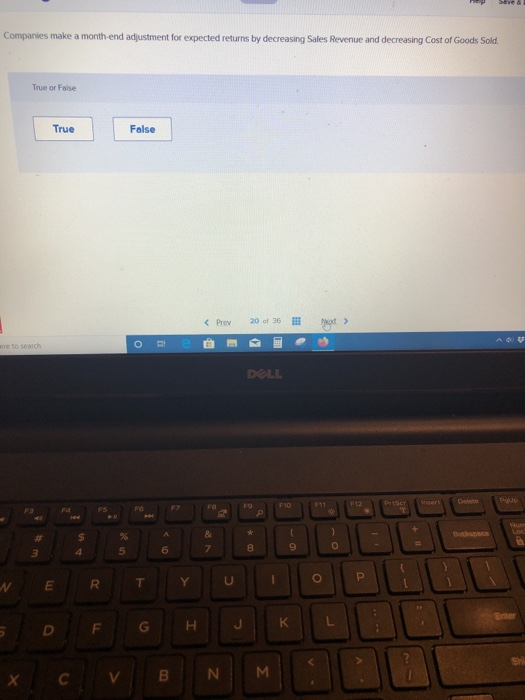
Where is `backspace key on keyboard`? backspace key on keyboard is located at coordinates (467, 535).